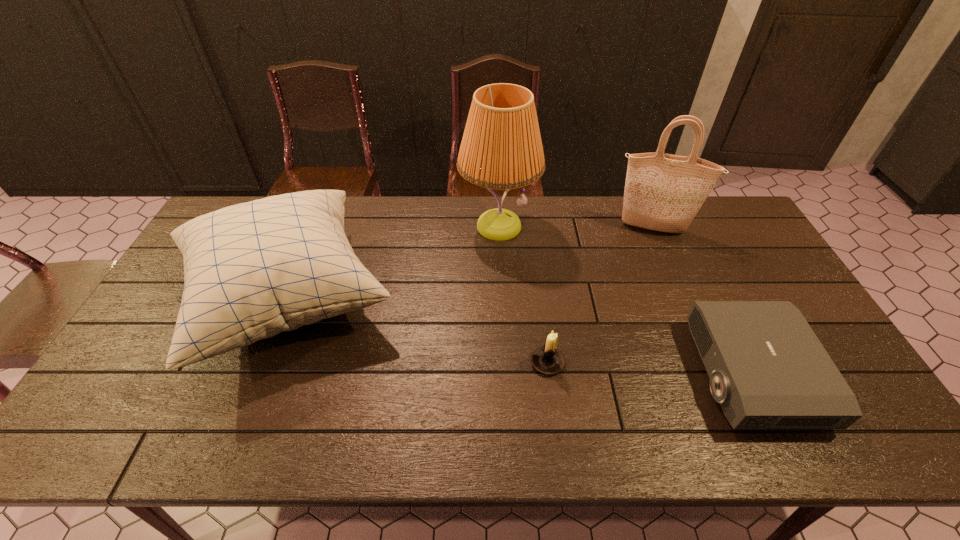
Locate an element on the screen. The image size is (960, 540). free spot between the leftmost object and the projector is located at coordinates (520, 336).

Identify the location of vacant region between the projector and the fourth shortest object. This screenshot has height=540, width=960. (703, 301).

I want to click on empty location between the leftmost object and the shopping bag, so click(x=471, y=264).

Locate an element on the screen. free point between the shopping bag and the projector is located at coordinates (703, 301).

You are a GUI agent. You are given a task and a screenshot of the screen. Output one action in this format:
    pyautogui.click(x=<x>, y=<y>)
    Task: Click on the free space between the projector and the lamp
    
    Given the screenshot: What is the action you would take?
    pyautogui.click(x=625, y=300)

Locate an element on the screen. This screenshot has width=960, height=540. unoccupied position between the projector and the lamp is located at coordinates (625, 300).

Choose which object is the nearest neighbor to the third shortest object. Please provide its 2D coordinates. Your answer should be formatted as a tuple, i.e. [(x, y)], where the tuple contains the x and y coordinates of a point satisfying the conditions above.

[(501, 148)]

Select which object is the third closest to the fourth shortest object. Please provide its 2D coordinates. Your answer should be formatted as a tuple, i.e. [(x, y)], where the tuple contains the x and y coordinates of a point satisfying the conditions above.

[(547, 359)]

Locate an element on the screen. free location that satisfies the following two spatial constraints: 1. on the side of the shopping bag near the pull switch; 2. on the right side of the lamp is located at coordinates (498, 228).

Where is `free space that satisfies the following two spatial constraints: 1. on the side of the lamp near the pull switch; 2. on the left side of the candle holder`? The width and height of the screenshot is (960, 540). free space that satisfies the following two spatial constraints: 1. on the side of the lamp near the pull switch; 2. on the left side of the candle holder is located at coordinates (505, 362).